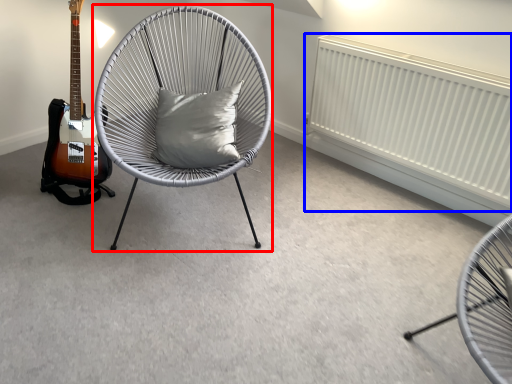
Question: Which of the following is the closest to the observer, chair (highlighted by a red box) or radiator (highlighted by a blue box)?

Choices:
 (A) chair
 (B) radiator

Answer: (A)